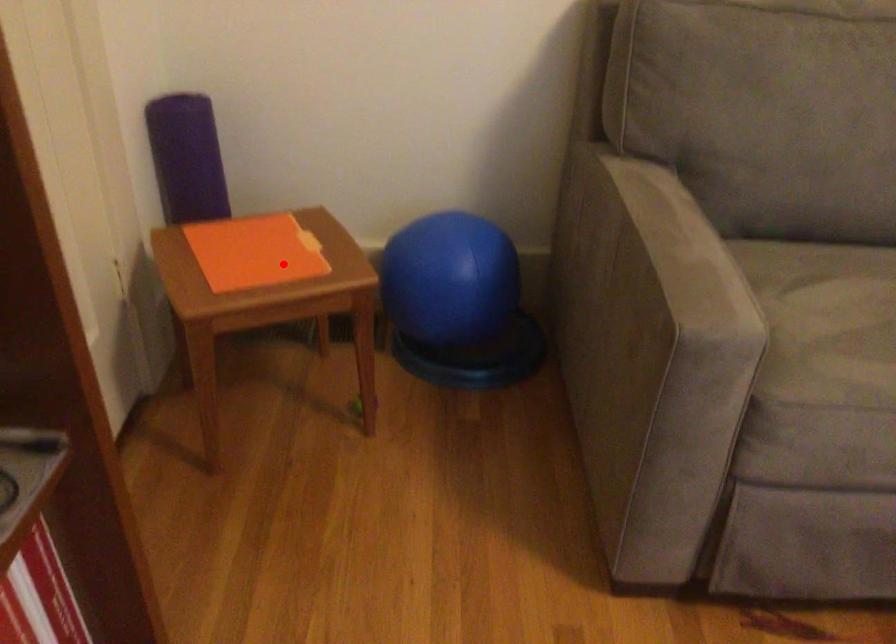
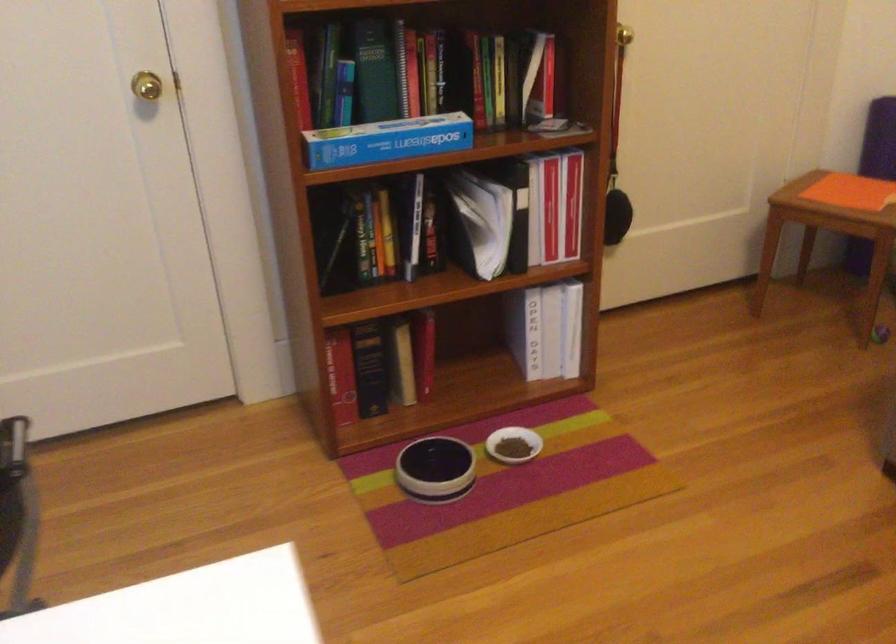
In the second image, find the point that corresponds to the highlighted location in the first image.

(840, 196)